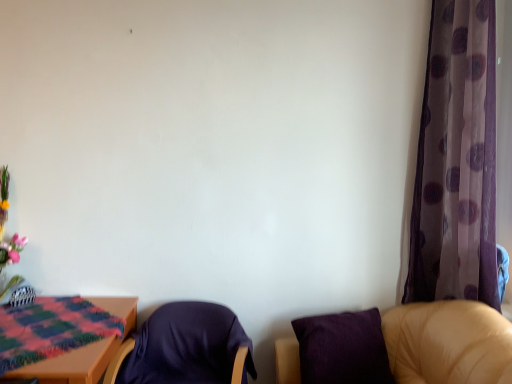
Question: From the image's perspective, is purple fabric chair at lower right, the second chair viewed from the left, over transparent purple curtain at right?

Choices:
 (A) yes
 (B) no

Answer: (B)

Question: Does purple fabric chair at lower right, the 1th chair from the right, touch transparent purple curtain at right?

Choices:
 (A) yes
 (B) no

Answer: (B)

Question: Is purple fabric chair at lower right, the 1th chair from the right, further to camera compared to transparent purple curtain at right?

Choices:
 (A) yes
 (B) no

Answer: (B)

Question: Is purple fabric chair at lower right, the 1th chair from the right, positioned beyond the bounds of transparent purple curtain at right?

Choices:
 (A) yes
 (B) no

Answer: (A)

Question: From a real-world perspective, is purple fabric chair at lower right, the 1th chair from the right, located beneath transparent purple curtain at right?

Choices:
 (A) no
 (B) yes

Answer: (B)

Question: From the image's perspective, is matte ceramic vase at left located beneath purple fabric chair at lower right, the 1th chair from the right?

Choices:
 (A) no
 (B) yes

Answer: (A)

Question: Is matte ceramic vase at left further to camera compared to purple fabric chair at lower right, the second chair viewed from the left?

Choices:
 (A) yes
 (B) no

Answer: (A)

Question: Can you confirm if matte ceramic vase at left is shorter than purple fabric chair at lower right, the 1th chair from the right?

Choices:
 (A) no
 (B) yes

Answer: (A)

Question: Are matte ceramic vase at left and purple fabric chair at lower right, the 1th chair from the right, making contact?

Choices:
 (A) no
 (B) yes

Answer: (A)

Question: From a real-world perspective, does matte ceramic vase at left sit lower than purple fabric chair at lower right, the 1th chair from the right?

Choices:
 (A) no
 (B) yes

Answer: (A)

Question: Is matte ceramic vase at left at the right side of purple fabric chair at lower right, the second chair viewed from the left?

Choices:
 (A) no
 (B) yes

Answer: (A)

Question: Is purple fabric chair at lower right, the second chair viewed from the left, positioned far away from dark blue fabric chair at center, which appears as the 2th chair when viewed from the right?

Choices:
 (A) yes
 (B) no

Answer: (B)